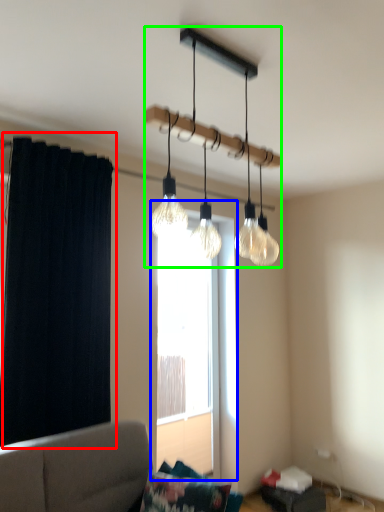
Question: Considering the real-world distances, which object is farthest from curtain (highlighted by a red box)? window (highlighted by a blue box) or lamp (highlighted by a green box)?

Choices:
 (A) window
 (B) lamp

Answer: (A)